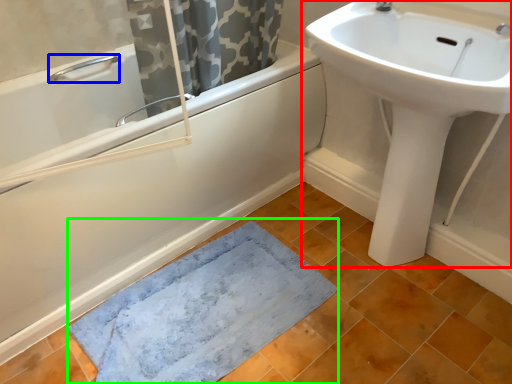
Question: Which object is the farthest from sink (highlighted by a red box)? Choose among these: plumbing fixture (highlighted by a blue box) or bath mat (highlighted by a green box).

Choices:
 (A) plumbing fixture
 (B) bath mat

Answer: (A)